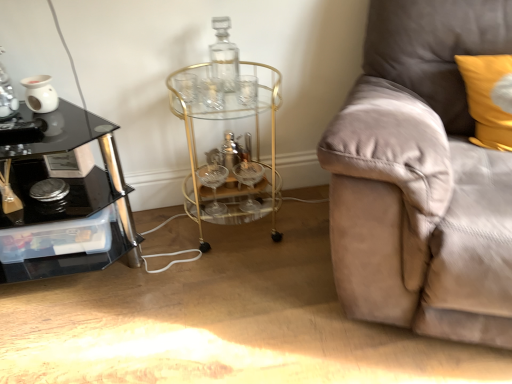
Question: Is yellow fabric pillow at upper right bigger or smaller than transparent glass bottle at center?

Choices:
 (A) small
 (B) big

Answer: (B)

Question: Is yellow fabric pillow at upper right situated inside transparent glass bottle at center or outside?

Choices:
 (A) outside
 (B) inside

Answer: (A)

Question: Based on their relative distances, which object is farther from the gold metallic bar cart at center?

Choices:
 (A) transparent glass bottle at center
 (B) yellow fabric pillow at upper right
 (C) black glass table at left
 (D) suede couch at right

Answer: (B)

Question: Estimate the real-world distances between objects in this image. Which object is farther from the transparent glass bottle at center?

Choices:
 (A) suede couch at right
 (B) yellow fabric pillow at upper right
 (C) black glass table at left
 (D) gold metallic bar cart at center

Answer: (B)